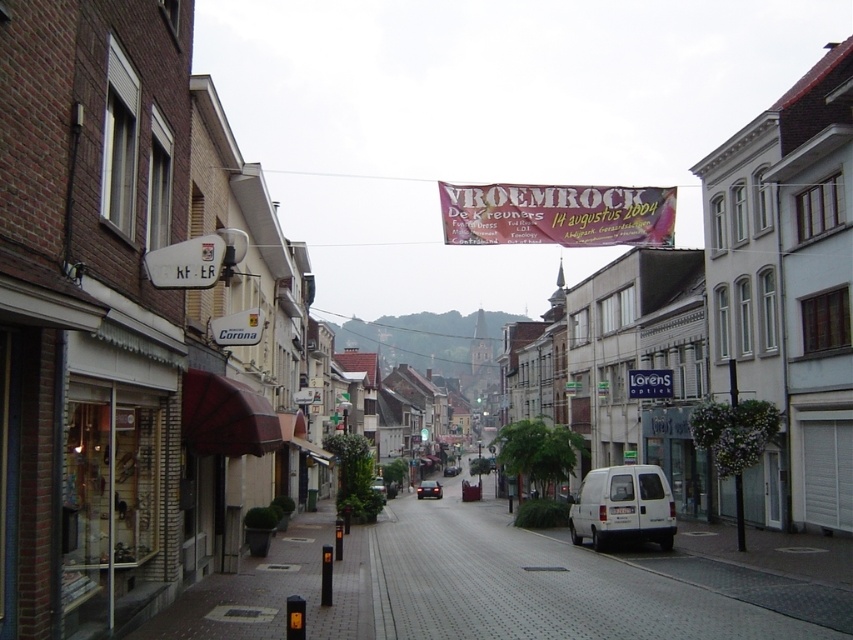
Between shiny black sedan at center and shiny black car at center, which one appears on the right side from the viewer's perspective?

shiny black car at center

Does shiny black sedan at center have a greater width compared to shiny black car at center?

No, shiny black sedan at center is not wider than shiny black car at center.

Between point (440, 497) and point (448, 468), which one is positioned in front?

Point (440, 497)

Where is `shiny black sedan at center`? shiny black sedan at center is located at coordinates (428, 490).

Is shiny black sedan at center shorter than dark gray metallic van at center?

Correct, shiny black sedan at center is not as tall as dark gray metallic van at center.

Which is below, shiny black sedan at center or dark gray metallic van at center?

shiny black sedan at center is lower down.

This screenshot has height=640, width=853. What are the coordinates of `shiny black sedan at center` in the screenshot? It's located at (428, 490).

Is vivid pink fabric banner at center to the right of dark gray metallic van at center from the viewer's perspective?

Correct, you'll find vivid pink fabric banner at center to the right of dark gray metallic van at center.

What do you see at coordinates (556, 214) in the screenshot?
I see `vivid pink fabric banner at center` at bounding box center [556, 214].

The width and height of the screenshot is (853, 640). Describe the element at coordinates (556, 214) in the screenshot. I see `vivid pink fabric banner at center` at that location.

Image resolution: width=853 pixels, height=640 pixels. Find the location of `vivid pink fabric banner at center`. vivid pink fabric banner at center is located at coordinates (556, 214).